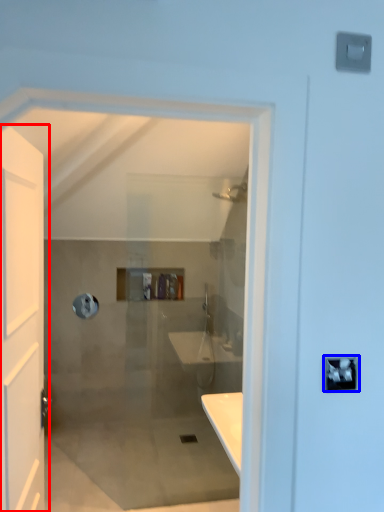
Question: Which object appears closest to the camera in this image, door (highlighted by a red box) or lock (highlighted by a blue box)?

Choices:
 (A) door
 (B) lock

Answer: (A)